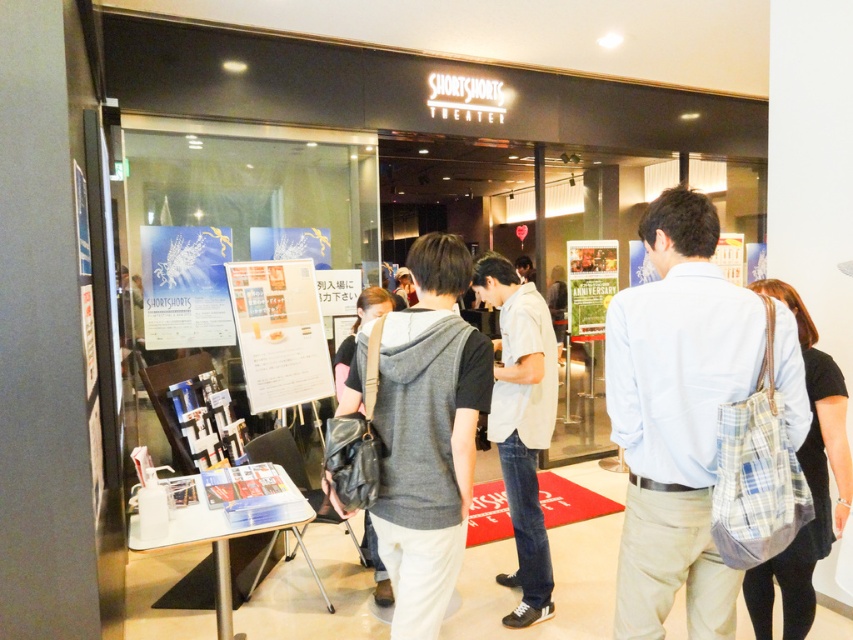
Measure the distance between plaid fabric bag at center and green paper poster at center.

plaid fabric bag at center and green paper poster at center are 9.28 feet apart.

Image resolution: width=853 pixels, height=640 pixels. Find the location of `plaid fabric bag at center`. plaid fabric bag at center is located at coordinates (807, 484).

This screenshot has height=640, width=853. What do you see at coordinates (807, 484) in the screenshot? I see `plaid fabric bag at center` at bounding box center [807, 484].

This screenshot has width=853, height=640. Identify the location of plaid fabric bag at center. (807, 484).

Is light blue shirt at center to the right of green paper poster at center from the viewer's perspective?

In fact, light blue shirt at center is to the left of green paper poster at center.

Image resolution: width=853 pixels, height=640 pixels. I want to click on light blue shirt at center, so click(676, 417).

Locate an element on the screen. The image size is (853, 640). light blue shirt at center is located at coordinates (676, 417).

Which is behind, point (502, 420) or point (194, 294)?

Point (194, 294)

Which is behind, point (537, 445) or point (161, 316)?

Positioned behind is point (161, 316).

At what (x,y) coordinates should I click in order to perform the action: click on light beige cotton shirt at center. Please return your answer as a coordinate pair (x, y). This screenshot has width=853, height=640. Looking at the image, I should click on (521, 422).